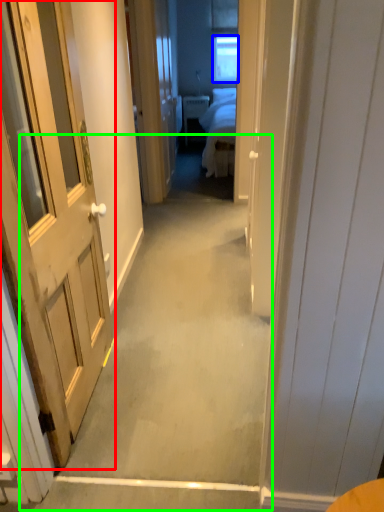
Question: Estimate the real-world distances between objects in this image. Which object is closer to door (highlighted by a red box), window (highlighted by a blue box) or path (highlighted by a green box)?

Choices:
 (A) window
 (B) path

Answer: (B)